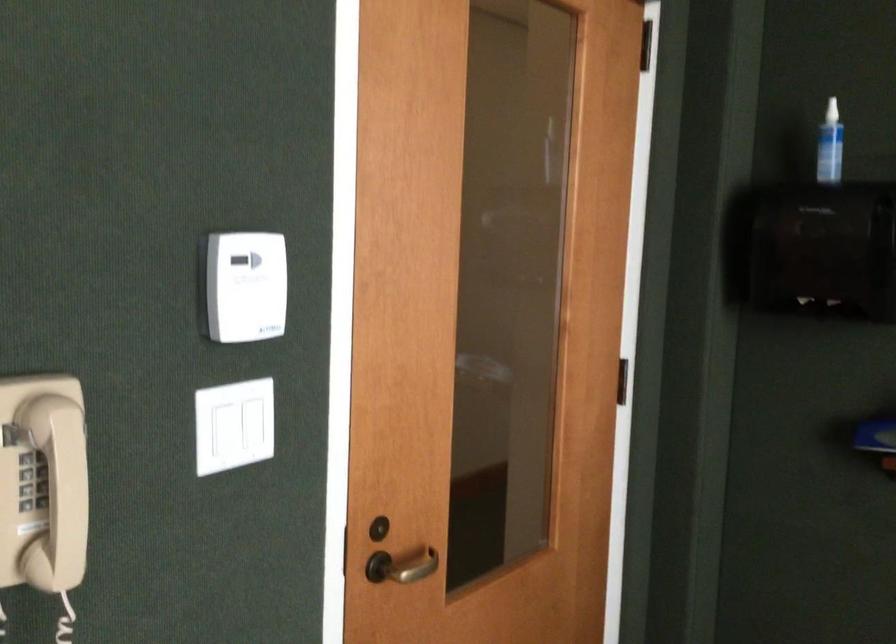
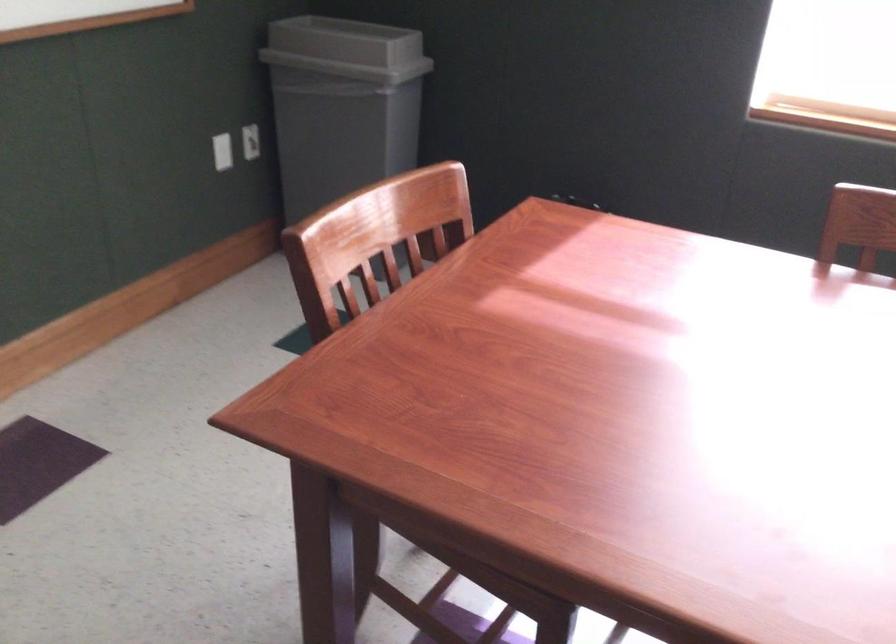
The first image is from the beginning of the video and the second image is from the end. How did the camera likely rotate when shooting the video?

The camera rotated toward right-down.